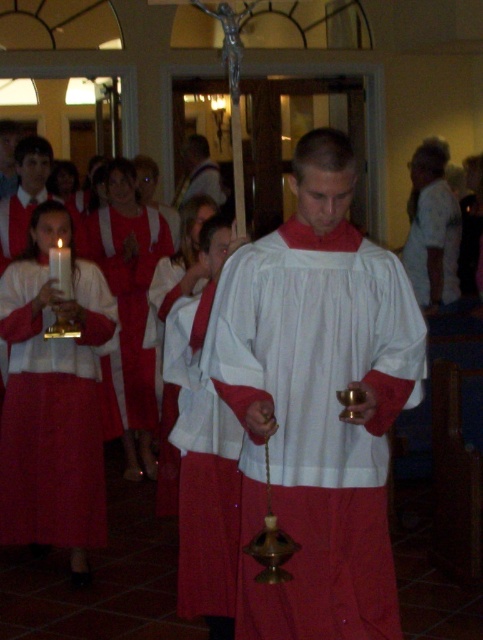
Question: Does matte white robe at left appear under white matte fabric at center?

Choices:
 (A) no
 (B) yes

Answer: (A)

Question: Which point appears farthest from the camera in this image?

Choices:
 (A) (417, 314)
 (B) (24, 429)
 (C) (201, 432)

Answer: (B)

Question: Estimate the real-world distances between objects in this image. Which object is farther from the matte white robe at left?

Choices:
 (A) white matte/soft fabric robe at center
 (B) white matte fabric at center
 (C) matte white robe at center

Answer: (A)

Question: Is the position of white matte/soft fabric robe at center less distant than that of white matte fabric at center?

Choices:
 (A) no
 (B) yes

Answer: (B)

Question: Which of the following is the closest to the observer?

Choices:
 (A) (228, 580)
 (B) (125, 234)
 (C) (327, 502)
 (D) (36, 376)

Answer: (C)

Question: Is white matte/soft fabric robe at center above matte white robe at center?

Choices:
 (A) no
 (B) yes

Answer: (A)